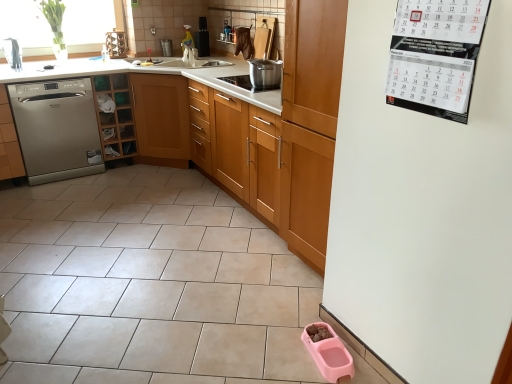
Find the location of a particular element. satin silver dishwasher at left, placed as the first cabinetry when sorted from left to right is located at coordinates (8, 142).

Locate an element on the screen. Image resolution: width=512 pixels, height=384 pixels. pink plastic pet food bowl at lower right is located at coordinates (329, 354).

This screenshot has width=512, height=384. What do you see at coordinates (309, 123) in the screenshot?
I see `wooden cabinet at center, which is the third cabinetry in left-to-right order` at bounding box center [309, 123].

Identify the location of wooden cabinet at left, the second cabinetry positioned from the right. (115, 115).

Find the location of `satin silver dishwasher at left`. satin silver dishwasher at left is located at coordinates (56, 129).

The image size is (512, 384). Identify the location of white ceramic sink at upper center. (179, 62).

Find the location of a particular element. stainless steel pot at center is located at coordinates (251, 83).

Can we say pink plastic pet food bowl at lower right lies outside satin silver dishwasher at left?

Yes, pink plastic pet food bowl at lower right is outside of satin silver dishwasher at left.

What are the coordinates of `appliance directly beneath the satin silver dishwasher at left (from a real-world perspective)` in the screenshot? It's located at pyautogui.click(x=329, y=354).

Looking at this image, which object is thinner, pink plastic pet food bowl at lower right or satin silver dishwasher at left?

With smaller width is pink plastic pet food bowl at lower right.

Is pink plastic pet food bowl at lower right placed right next to satin silver dishwasher at left?

No, pink plastic pet food bowl at lower right is not with satin silver dishwasher at left.

This screenshot has width=512, height=384. In the image, there is a satin silver dishwasher at left. Find the location of `bulletin board below it (from the image's perspective)`. bulletin board below it (from the image's perspective) is located at coordinates (435, 55).

Does point (71, 124) appear closer or farther from the camera than point (403, 99)?

Point (71, 124).

Are satin silver dishwasher at left and white paper calendar at upper right located far from each other?

Yes.

Looking at this image, from a real-world perspective, is satin silver dishwasher at left on white paper calendar at upper right?

No.

Considering the positions of points (175, 59) and (7, 163), is point (175, 59) closer to camera compared to point (7, 163)?

That is False.

Is white ceramic sink at upper center not near satin silver dishwasher at left, placed as the first cabinetry when sorted from left to right?

Absolutely, white ceramic sink at upper center is distant from satin silver dishwasher at left, placed as the first cabinetry when sorted from left to right.

Is white ceramic sink at upper center in front of satin silver dishwasher at left, which is counted as the 3th cabinetry, starting from the right?

No, white ceramic sink at upper center is behind satin silver dishwasher at left, which is counted as the 3th cabinetry, starting from the right.

Considering the relative sizes of wooden cabinet at left, the second cabinetry positioned from the right, and pink plastic pet food bowl at lower right in the image provided, is wooden cabinet at left, the second cabinetry positioned from the right, smaller than pink plastic pet food bowl at lower right?

Incorrect, wooden cabinet at left, the second cabinetry positioned from the right, is not smaller in size than pink plastic pet food bowl at lower right.

Does wooden cabinet at left, which ranks as the 2th cabinetry in left-to-right order, appear on the left side of pink plastic pet food bowl at lower right?

Indeed, wooden cabinet at left, which ranks as the 2th cabinetry in left-to-right order, is positioned on the left side of pink plastic pet food bowl at lower right.

Is wooden cabinet at left, which ranks as the 2th cabinetry in left-to-right order, not close to pink plastic pet food bowl at lower right?

Yes.

Who is shorter, wooden cabinet at left, which ranks as the 2th cabinetry in left-to-right order, or pink plastic pet food bowl at lower right?

pink plastic pet food bowl at lower right.

Where is `appliance beneath the wooden cabinet at center, which is the third cabinetry in left-to-right order (from a real-world perspective)`? The width and height of the screenshot is (512, 384). appliance beneath the wooden cabinet at center, which is the third cabinetry in left-to-right order (from a real-world perspective) is located at coordinates (329, 354).

Which object is closer to the camera, pink plastic pet food bowl at lower right or wooden cabinet at center, the 1th cabinetry positioned from the right?

pink plastic pet food bowl at lower right is closer to the camera.

Is pink plastic pet food bowl at lower right turned away from wooden cabinet at center, which is the third cabinetry in left-to-right order?

No, pink plastic pet food bowl at lower right is not facing away from wooden cabinet at center, which is the third cabinetry in left-to-right order.

What's the angular difference between pink plastic pet food bowl at lower right and wooden cabinet at center, the 1th cabinetry positioned from the right,'s facing directions?

pink plastic pet food bowl at lower right and wooden cabinet at center, the 1th cabinetry positioned from the right, are facing 4.7 degrees away from each other.

From a real-world perspective, is stainless steel pot at center physically below satin silver dishwasher at left?

No, from a real-world perspective, stainless steel pot at center is not beneath satin silver dishwasher at left.

Between stainless steel pot at center and satin silver dishwasher at left, which one is positioned behind?

Positioned behind is satin silver dishwasher at left.

Is satin silver dishwasher at left completely or partially inside stainless steel pot at center?

No, satin silver dishwasher at left is located outside of stainless steel pot at center.

Which cabinetry is the 1st one when counting from the back of the stainless steel pot at center? Please provide its 2D coordinates.

[(8, 142)]

Considering the sizes of satin silver dishwasher at left, placed as the first cabinetry when sorted from left to right, and stainless steel pot at center in the image, is satin silver dishwasher at left, placed as the first cabinetry when sorted from left to right, taller or shorter than stainless steel pot at center?

Considering their sizes, satin silver dishwasher at left, placed as the first cabinetry when sorted from left to right, has more height than stainless steel pot at center.

From the image's perspective, does satin silver dishwasher at left, which is counted as the 3th cabinetry, starting from the right, appear lower than stainless steel pot at center?

Indeed, from the image's perspective, satin silver dishwasher at left, which is counted as the 3th cabinetry, starting from the right, is shown beneath stainless steel pot at center.

From a real-world perspective, is satin silver dishwasher at left, placed as the first cabinetry when sorted from left to right, above or below stainless steel pot at center?

satin silver dishwasher at left, placed as the first cabinetry when sorted from left to right, is below stainless steel pot at center.

Image resolution: width=512 pixels, height=384 pixels. In order to click on dishwasher on the left of pink plastic pet food bowl at lower right in this screenshot , I will do `click(56, 129)`.

At what (x,y) coordinates should I click in order to perform the action: click on dishwasher behind the white paper calendar at upper right. Please return your answer as a coordinate pair (x, y). This screenshot has height=384, width=512. Looking at the image, I should click on (56, 129).

From the picture: From the image, which object appears to be nearer to satin silver dishwasher at left, which is counted as the 3th cabinetry, starting from the right, stainless steel pot at center or white paper calendar at upper right?

stainless steel pot at center is positioned closer to the anchor satin silver dishwasher at left, which is counted as the 3th cabinetry, starting from the right.

From the image, which object appears to be nearer to satin silver dishwasher at left, placed as the first cabinetry when sorted from left to right, wooden cabinet at center, which is the third cabinetry in left-to-right order, or pink plastic pet food bowl at lower right?

Based on the image, wooden cabinet at center, which is the third cabinetry in left-to-right order, appears to be nearer to satin silver dishwasher at left, placed as the first cabinetry when sorted from left to right.

Based on their spatial positions, is pink plastic pet food bowl at lower right or white ceramic sink at upper center further from satin silver dishwasher at left?

Based on the image, pink plastic pet food bowl at lower right appears to be further to satin silver dishwasher at left.

Considering their positions, is pink plastic pet food bowl at lower right positioned closer to white ceramic sink at upper center than satin silver dishwasher at left, placed as the first cabinetry when sorted from left to right?

Among the two, satin silver dishwasher at left, placed as the first cabinetry when sorted from left to right, is located nearer to white ceramic sink at upper center.

Estimate the real-world distances between objects in this image. Which object is further from satin silver dishwasher at left, which is counted as the 3th cabinetry, starting from the right, white paper calendar at upper right or stainless steel pot at center?

Among the two, white paper calendar at upper right is located further to satin silver dishwasher at left, which is counted as the 3th cabinetry, starting from the right.

Based on their spatial positions, is pink plastic pet food bowl at lower right or wooden cabinet at center, which is the third cabinetry in left-to-right order, further from white ceramic sink at upper center?

pink plastic pet food bowl at lower right is further to white ceramic sink at upper center.

From the image, which object appears to be farther from white ceramic sink at upper center, satin silver dishwasher at left, which is counted as the 3th cabinetry, starting from the right, or satin silver dishwasher at left?

The object further to white ceramic sink at upper center is satin silver dishwasher at left, which is counted as the 3th cabinetry, starting from the right.

Which object lies further to the anchor point white paper calendar at upper right, white ceramic sink at upper center or stainless steel pot at center?

white ceramic sink at upper center lies further to white paper calendar at upper right than the other object.

Identify the location of bulletin board between wooden cabinet at center, which is the third cabinetry in left-to-right order, and pink plastic pet food bowl at lower right, in the vertical direction. The image size is (512, 384). (435, 55).

Find the location of a particular element. The width and height of the screenshot is (512, 384). appliance located between satin silver dishwasher at left, placed as the first cabinetry when sorted from left to right, and white paper calendar at upper right in the left-right direction is located at coordinates (329, 354).

Where is `sink situated between satin silver dishwasher at left and pink plastic pet food bowl at lower right from left to right`? This screenshot has height=384, width=512. sink situated between satin silver dishwasher at left and pink plastic pet food bowl at lower right from left to right is located at coordinates (179, 62).

Locate an element on the screen. cabinetry situated between satin silver dishwasher at left, which is counted as the 3th cabinetry, starting from the right, and white ceramic sink at upper center from left to right is located at coordinates (115, 115).